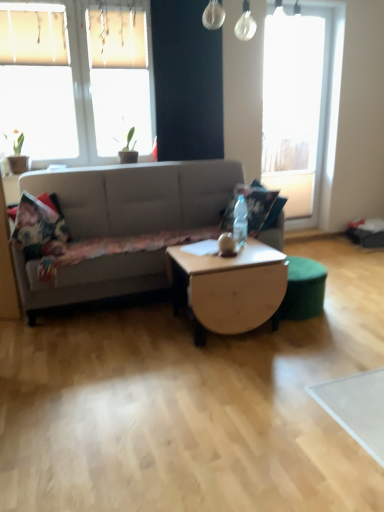
This screenshot has height=512, width=384. I want to click on free spot above wooden coffee table at center (from a real-world perspective), so (219, 253).